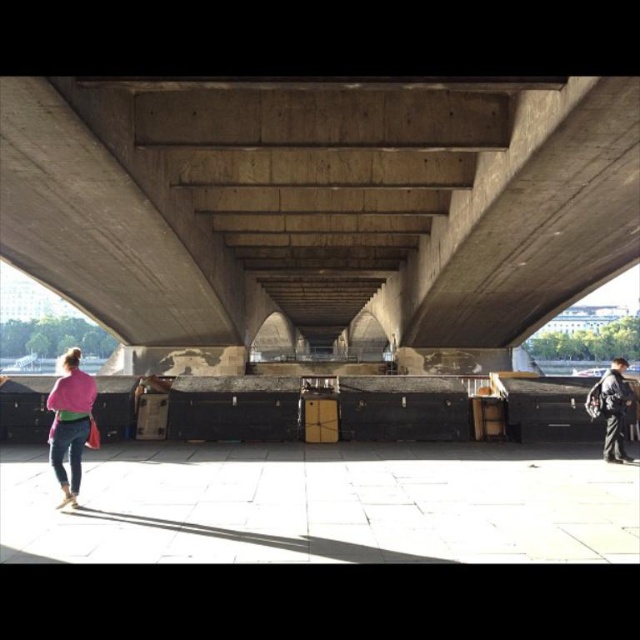
Where is `concrete at center`? concrete at center is located at coordinates (320, 204).

Is concrete at center closer to the viewer compared to pink fabric at left?

That is False.

Does point (410, 278) come in front of point (52, 472)?

No, it is behind (52, 472).

At what (x,y) coordinates should I click in order to perform the action: click on concrete at center. Please return your answer as a coordinate pair (x, y). This screenshot has width=640, height=640. Looking at the image, I should click on (320, 204).

Who is more forward, (547, 195) or (608, 403)?

Positioned in front is point (608, 403).

Find the location of a particular element. The width and height of the screenshot is (640, 640). concrete at center is located at coordinates (320, 204).

This screenshot has height=640, width=640. What are the coordinates of `concrete at center` in the screenshot? It's located at (320, 204).

Who is taller, pink fabric at left or dark gray fabric jacket at lower right?

With more height is pink fabric at left.

Which of these two, pink fabric at left or dark gray fabric jacket at lower right, stands shorter?

With less height is dark gray fabric jacket at lower right.

Which is in front, point (68, 368) or point (611, 400)?

Positioned in front is point (68, 368).

Where is `pink fabric at left`? This screenshot has height=640, width=640. pink fabric at left is located at coordinates (68, 422).